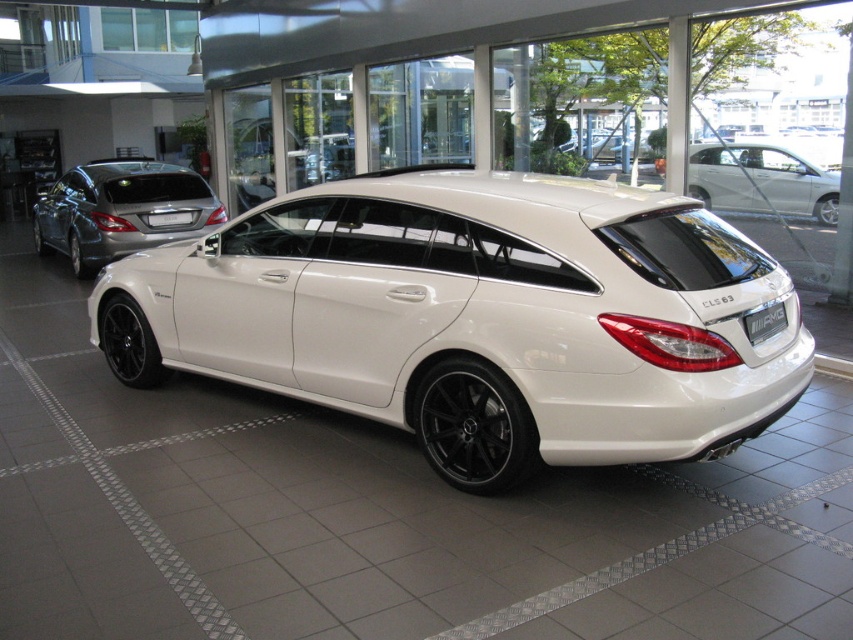
Question: Considering the real-world distances, which object is closest to the white glossy car at center?

Choices:
 (A) black matte rim at lower left
 (B) black matte rim at lower center
 (C) white matte car at upper right
 (D) satin silver sedan at left

Answer: (B)

Question: Is satin silver sedan at left bigger than black matte rim at lower center?

Choices:
 (A) yes
 (B) no

Answer: (A)

Question: Does white glossy car at center appear on the right side of black matte rim at lower center?

Choices:
 (A) yes
 (B) no

Answer: (B)

Question: Which point is farther to the camera?

Choices:
 (A) (418, 385)
 (B) (167, 196)
 (C) (305, 320)

Answer: (B)

Question: Which object is the farthest from the white matte car at upper right?

Choices:
 (A) satin silver sedan at left
 (B) white glossy car at center
 (C) black matte rim at lower center

Answer: (A)

Question: Does white glossy car at center have a lesser width compared to white matte car at upper right?

Choices:
 (A) no
 (B) yes

Answer: (A)